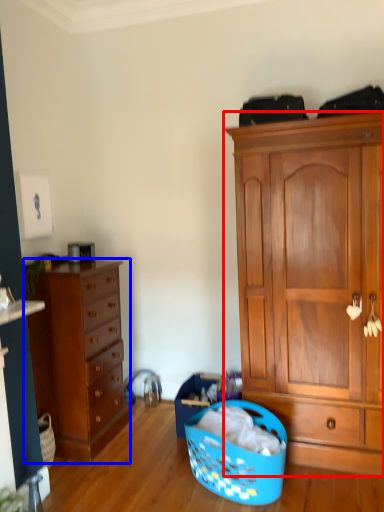
Question: Which of the following is the closest to the observer, cabinetry (highlighted by a red box) or chest of drawers (highlighted by a blue box)?

Choices:
 (A) cabinetry
 (B) chest of drawers

Answer: (A)